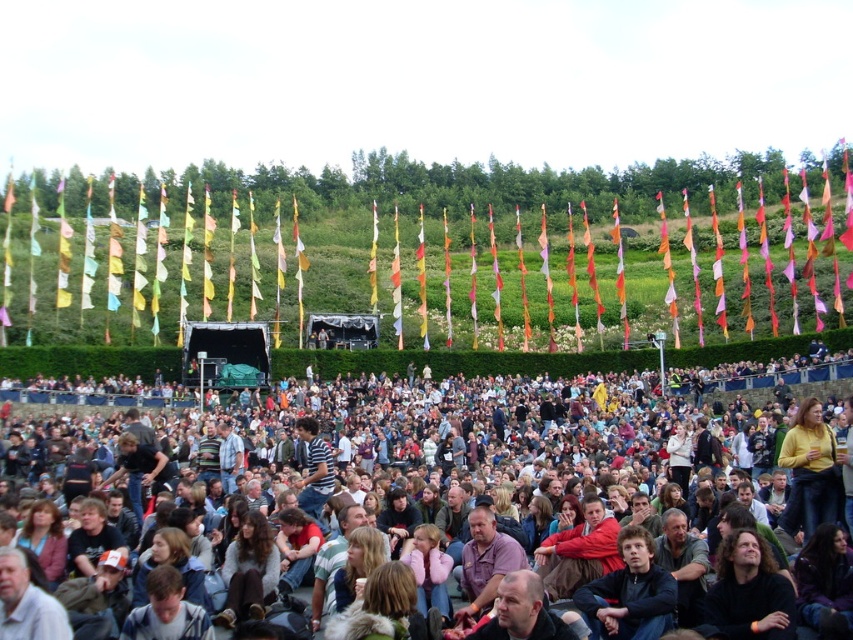
Question: Which object is farther from the camera taking this photo?

Choices:
 (A) multicolored fabric crowd at center
 (B) dark blue sweater at center

Answer: (B)

Question: Among these objects, which one is farthest from the camera?

Choices:
 (A) dark blue sweater at center
 (B) multicolored fabric crowd at center

Answer: (A)

Question: Does multicolored fabric crowd at center have a greater width compared to dark blue sweater at center?

Choices:
 (A) no
 (B) yes

Answer: (B)

Question: Can you confirm if multicolored fabric crowd at center is positioned above dark blue sweater at center?

Choices:
 (A) yes
 (B) no

Answer: (A)

Question: Is multicolored fabric crowd at center positioned at the back of dark blue sweater at center?

Choices:
 (A) no
 (B) yes

Answer: (A)